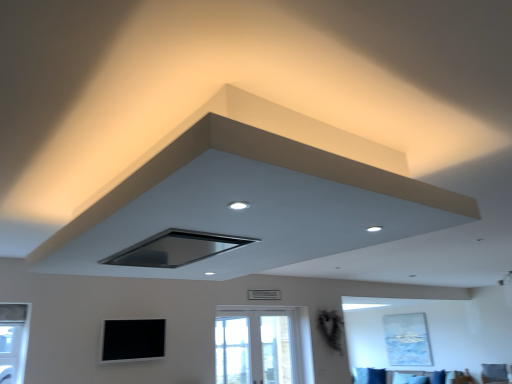
Question: Is white glass window at center wider than matte black exhaust hood at upper center, marked as the 1th exhaust hood in a right-to-left arrangement?

Choices:
 (A) no
 (B) yes

Answer: (A)

Question: Can you confirm if white glass window at center is bigger than matte black exhaust hood at upper center, marked as the 1th exhaust hood in a right-to-left arrangement?

Choices:
 (A) yes
 (B) no

Answer: (B)

Question: Considering the relative sizes of white glass window at center and matte black exhaust hood at upper center, which ranks as the second exhaust hood in left-to-right order, in the image provided, is white glass window at center shorter than matte black exhaust hood at upper center, which ranks as the second exhaust hood in left-to-right order,?

Choices:
 (A) no
 (B) yes

Answer: (A)

Question: Is white glass window at center not inside matte black exhaust hood at upper center, which ranks as the second exhaust hood in left-to-right order?

Choices:
 (A) no
 (B) yes

Answer: (B)

Question: Considering the relative positions of white glass window at center and matte black exhaust hood at upper center, which ranks as the second exhaust hood in left-to-right order, in the image provided, is white glass window at center behind matte black exhaust hood at upper center, which ranks as the second exhaust hood in left-to-right order,?

Choices:
 (A) yes
 (B) no

Answer: (A)

Question: From the image's perspective, is black matte exhaust hood at center, positioned as the first exhaust hood in left-to-right order, positioned above or below black matte window screen at lower center?

Choices:
 (A) below
 (B) above

Answer: (B)

Question: Relative to black matte window screen at lower center, is black matte exhaust hood at center, positioned as the first exhaust hood in left-to-right order, in front or behind?

Choices:
 (A) behind
 (B) front

Answer: (B)

Question: Considering the positions of black matte exhaust hood at center, positioned as the first exhaust hood in left-to-right order, and black matte window screen at lower center in the image, is black matte exhaust hood at center, positioned as the first exhaust hood in left-to-right order, wider or thinner than black matte window screen at lower center?

Choices:
 (A) thin
 (B) wide

Answer: (B)

Question: From a real-world perspective, relative to black matte window screen at lower center, is black matte exhaust hood at center, positioned as the first exhaust hood in left-to-right order, vertically above or below?

Choices:
 (A) below
 (B) above

Answer: (B)

Question: Is point (273, 294) positioned closer to the camera than point (330, 177)?

Choices:
 (A) closer
 (B) farther

Answer: (B)

Question: Visually, is gray metallic air conditioning unit at center positioned to the left or to the right of matte black exhaust hood at upper center, marked as the 1th exhaust hood in a right-to-left arrangement?

Choices:
 (A) left
 (B) right

Answer: (B)

Question: Would you say gray metallic air conditioning unit at center is inside or outside matte black exhaust hood at upper center, marked as the 1th exhaust hood in a right-to-left arrangement?

Choices:
 (A) outside
 (B) inside

Answer: (A)

Question: Considering their positions, is gray metallic air conditioning unit at center located in front of or behind matte black exhaust hood at upper center, marked as the 1th exhaust hood in a right-to-left arrangement?

Choices:
 (A) front
 (B) behind

Answer: (B)

Question: Is black matte window screen at lower center wider or thinner than white glass window at center?

Choices:
 (A) wide
 (B) thin

Answer: (A)

Question: Is point (112, 354) positioned closer to the camera than point (245, 317)?

Choices:
 (A) farther
 (B) closer

Answer: (B)